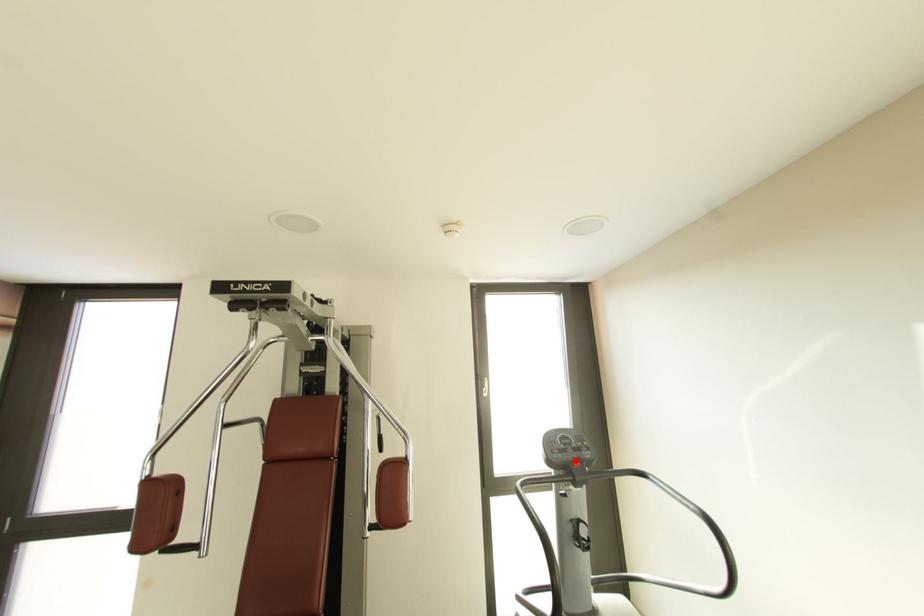
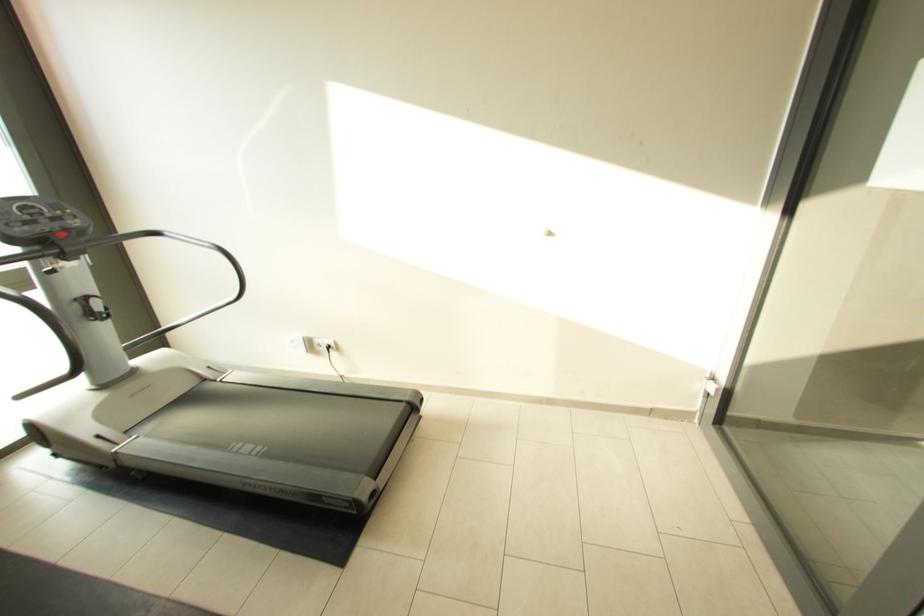
The point at the highlighted location is marked in the first image. Where is the corresponding point in the second image?

(54, 232)